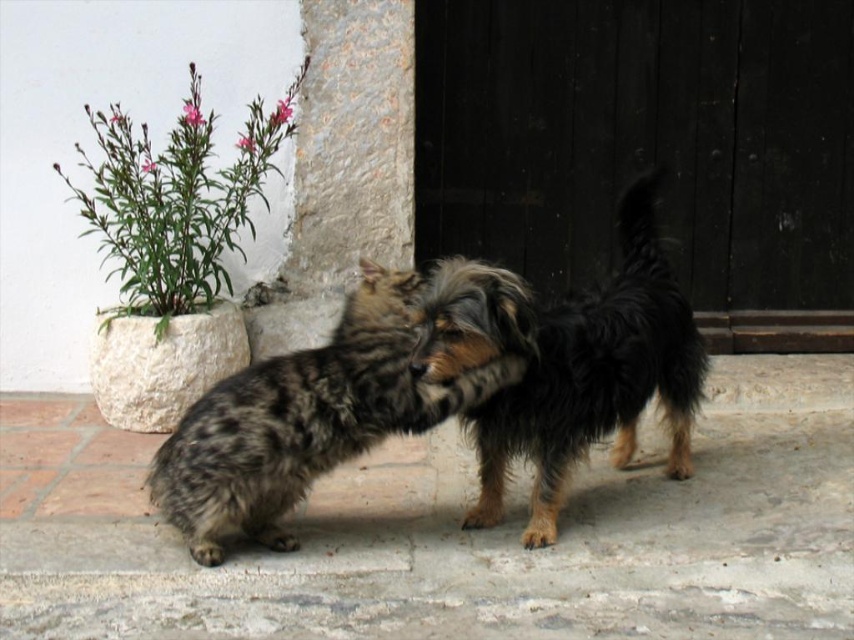
Question: Which of the following is the farthest from the observer?

Choices:
 (A) 471,360
 (B) 112,192
 (C) 225,524

Answer: (B)

Question: Which point appears farthest from the camera in this image?

Choices:
 (A) (150, 145)
 (B) (691, 376)

Answer: (A)

Question: Can you confirm if shaggy brown dog at center is positioned to the right of green leafy plant at upper left?

Choices:
 (A) no
 (B) yes

Answer: (B)

Question: Which of the following is the closest to the observer?

Choices:
 (A) shaggy brown dog at center
 (B) fluffy brown dog at center
 (C) green leafy plant at upper left

Answer: (A)

Question: Considering the relative positions of fluffy brown dog at center and green leafy plant at upper left in the image provided, where is fluffy brown dog at center located with respect to green leafy plant at upper left?

Choices:
 (A) right
 (B) left

Answer: (A)

Question: Considering the relative positions of shaggy brown dog at center and fluffy brown dog at center in the image provided, where is shaggy brown dog at center located with respect to fluffy brown dog at center?

Choices:
 (A) right
 (B) left

Answer: (A)